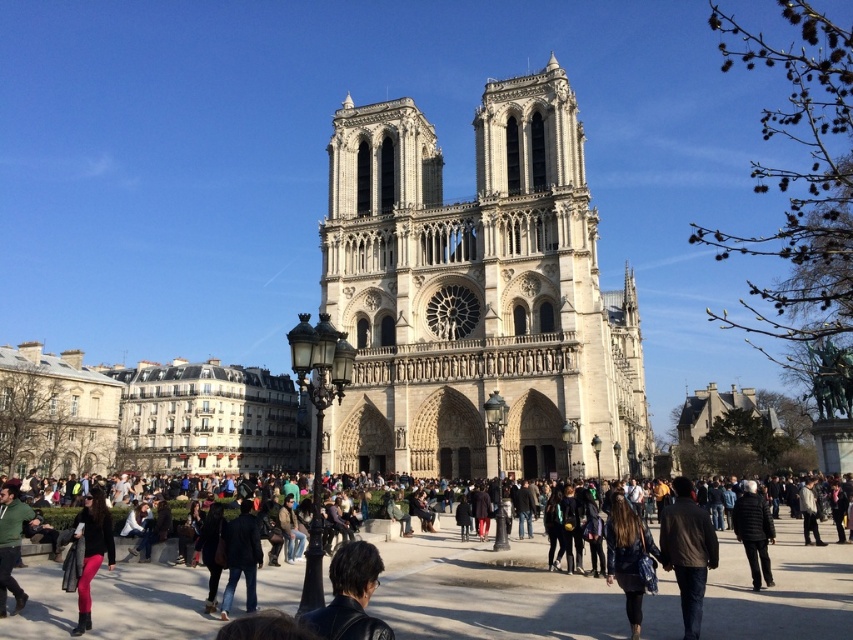
Question: Which object appears farthest from the camera in this image?

Choices:
 (A) dark blue jeans at center
 (B) matte black coat at lower left

Answer: (A)

Question: Can you confirm if white stone tower at center is positioned below matte black coat at lower left?

Choices:
 (A) no
 (B) yes

Answer: (A)

Question: Does brown leather jacket at lower right appear over dark blue jeans at center?

Choices:
 (A) yes
 (B) no

Answer: (A)

Question: Can you confirm if white stone tower at center is bigger than leather jacket at center?

Choices:
 (A) no
 (B) yes

Answer: (B)

Question: Among these points, which one is nearest to the camera?

Choices:
 (A) (361, 625)
 (B) (689, 630)
 (C) (755, 589)

Answer: (A)

Question: Which point appears closest to the camera in this image?

Choices:
 (A) (341, 550)
 (B) (96, 525)

Answer: (A)